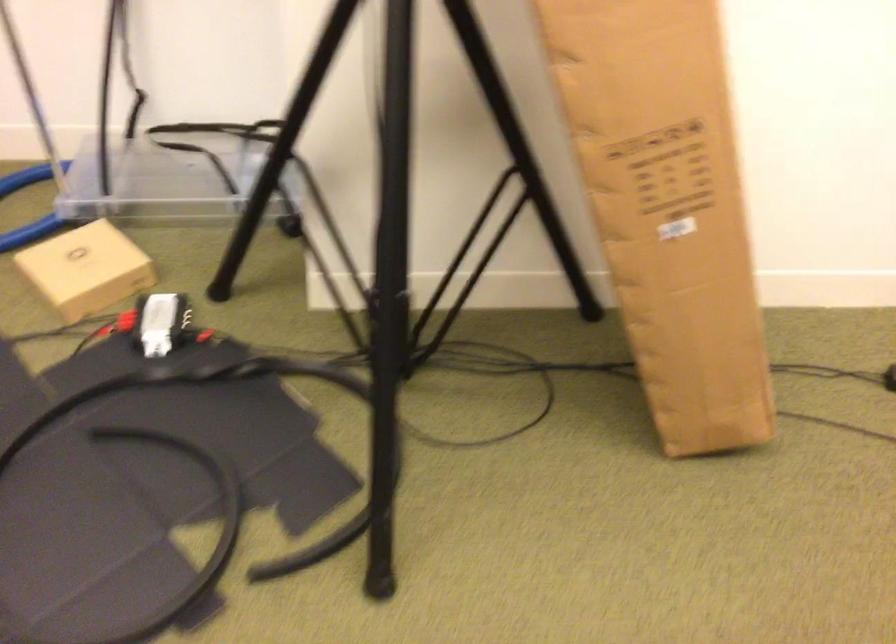
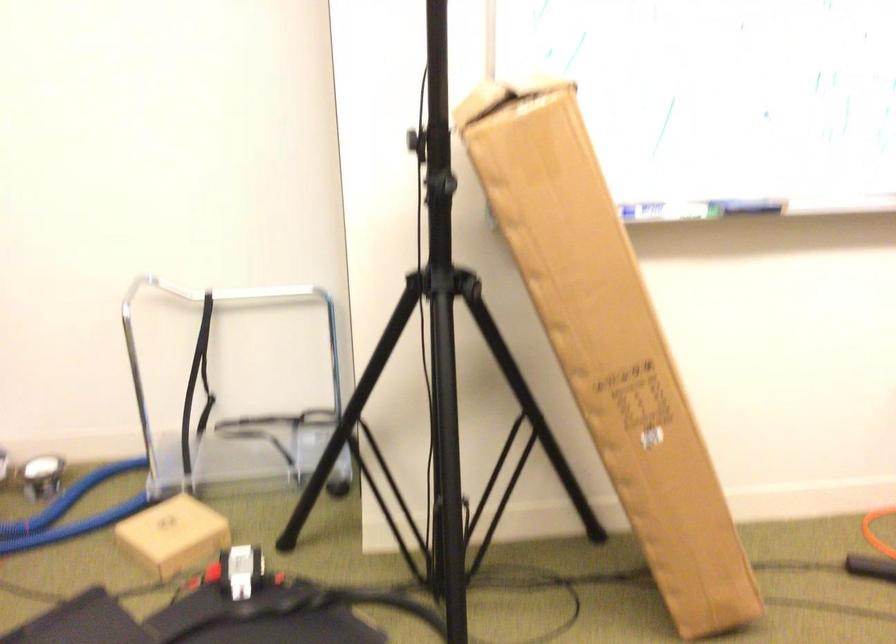
Where in the second image is the point corresponding to (157,326) from the first image?

(242, 572)